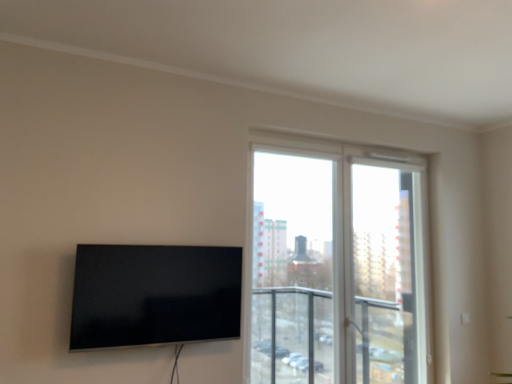
Question: Is matte black tv at left thinner than transparent glass screen door at upper right?

Choices:
 (A) no
 (B) yes

Answer: (B)

Question: Is matte black tv at left further to the viewer compared to transparent glass screen door at upper right?

Choices:
 (A) no
 (B) yes

Answer: (A)

Question: Is matte black tv at left positioned with its back to transparent glass screen door at upper right?

Choices:
 (A) yes
 (B) no

Answer: (B)

Question: From a real-world perspective, is matte black tv at left below transparent glass screen door at upper right?

Choices:
 (A) yes
 (B) no

Answer: (A)

Question: Can you see matte black tv at left touching transparent glass screen door at upper right?

Choices:
 (A) yes
 (B) no

Answer: (B)

Question: Is matte black tv at left closer to the viewer compared to transparent glass screen door at upper right?

Choices:
 (A) no
 (B) yes

Answer: (B)

Question: Is matte black tv at left to the right of transparent glass window at center from the viewer's perspective?

Choices:
 (A) no
 (B) yes

Answer: (A)

Question: Is transparent glass window at center inside matte black tv at left?

Choices:
 (A) yes
 (B) no

Answer: (B)

Question: Is matte black tv at left closer to camera compared to transparent glass window at center?

Choices:
 (A) yes
 (B) no

Answer: (A)

Question: Is the depth of matte black tv at left greater than that of transparent glass window at center?

Choices:
 (A) yes
 (B) no

Answer: (B)

Question: Is matte black tv at left not within transparent glass window at center?

Choices:
 (A) no
 (B) yes

Answer: (B)

Question: Considering the relative sizes of matte black tv at left and transparent glass window at center in the image provided, is matte black tv at left bigger than transparent glass window at center?

Choices:
 (A) yes
 (B) no

Answer: (B)

Question: Is transparent glass window at center not close to transparent glass screen door at upper right?

Choices:
 (A) no
 (B) yes

Answer: (B)